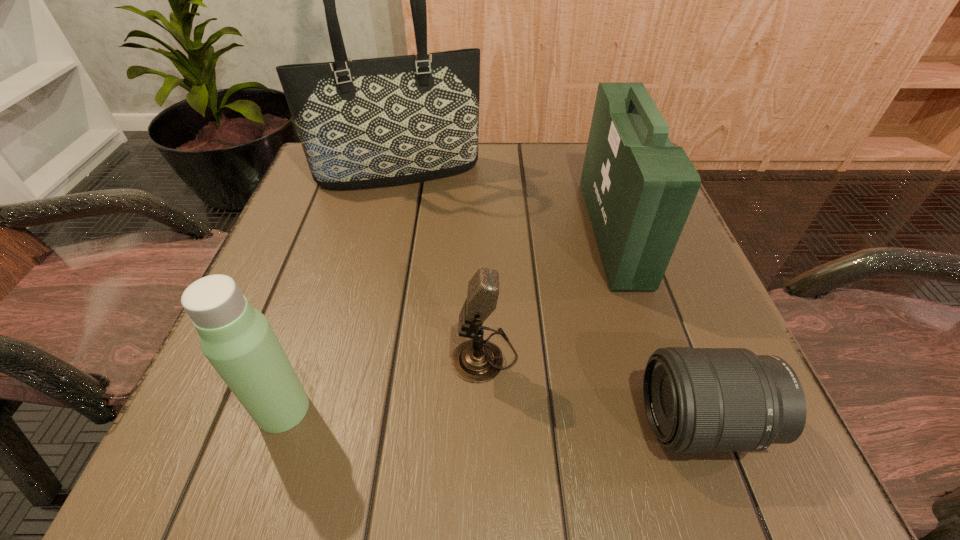
Where is `free space at the left edge`? The height and width of the screenshot is (540, 960). free space at the left edge is located at coordinates (332, 219).

In order to click on vacant space at the right edge in this screenshot , I will do `click(664, 291)`.

You are a GUI agent. You are given a task and a screenshot of the screen. Output one action in this format:
    pyautogui.click(x=<x>, y=<y>)
    Task: Click on the free spot at the far right corner of the desktop
    The image size is (960, 540).
    Given the screenshot: What is the action you would take?
    pyautogui.click(x=577, y=156)

The image size is (960, 540). In order to click on free space between the tote bag and the thermos bottle in this screenshot , I will do pos(341,291).

At what (x,y) coordinates should I click in order to perform the action: click on free area in between the shortest object and the microphone. Please return your answer as a coordinate pair (x, y). Looking at the image, I should click on [594, 388].

Locate an element on the screen. The width and height of the screenshot is (960, 540). free spot between the thermos bottle and the tallest object is located at coordinates (341, 291).

I want to click on free space between the fourth tallest object and the thermos bottle, so click(384, 382).

Locate an element on the screen. The width and height of the screenshot is (960, 540). free space between the thermos bottle and the tallest object is located at coordinates (341, 291).

At what (x,y) coordinates should I click in order to perform the action: click on blank region between the tote bag and the microphone. Please return your answer as a coordinate pair (x, y). This screenshot has width=960, height=540. Looking at the image, I should click on (442, 264).

Find the location of `free spot between the thermos bottle and the telephoto lens`. free spot between the thermos bottle and the telephoto lens is located at coordinates click(x=492, y=415).